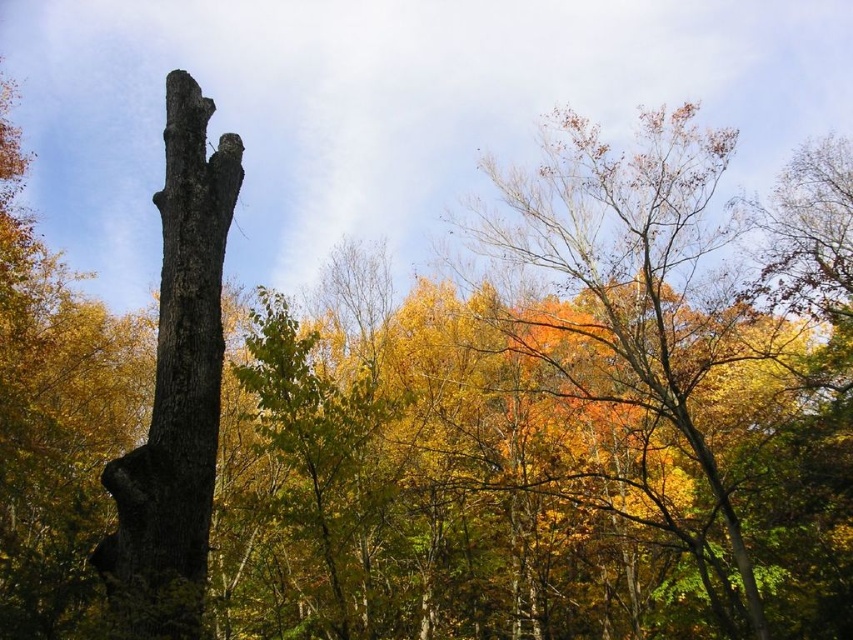
You are standing in the autumnal forest scene and want to walk from the point at coordinates point (607, 278) to the point at coordinates point (135, 516). Which direction should you move to get closer to your destination?

You should move towards the lower right direction because point (135, 516) is located lower and to the right of point (607, 278).